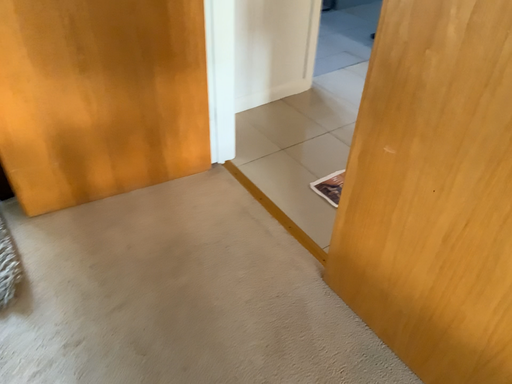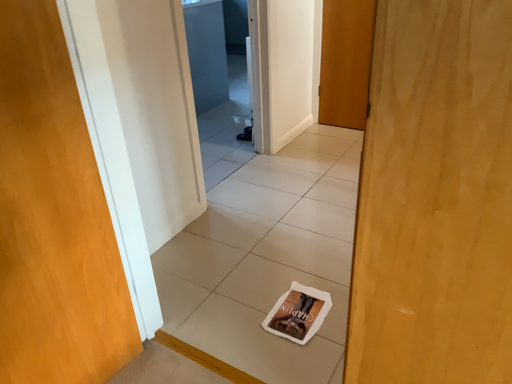
Question: Which way did the camera rotate in the video?

Choices:
 (A) rotated right
 (B) rotated left

Answer: (A)